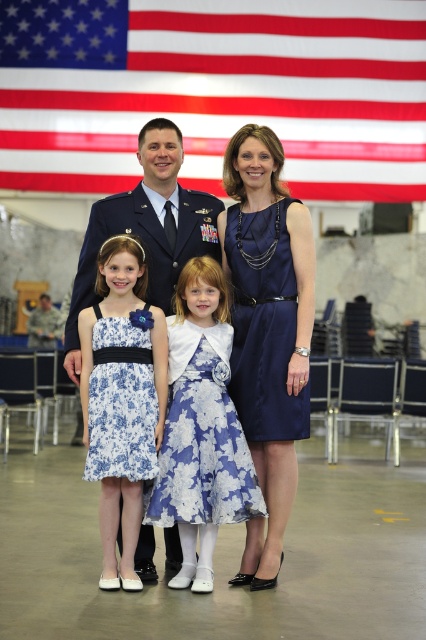
Question: Which is farther from the satin blue dress at center?

Choices:
 (A) red/white striped fabric at upper center
 (B) blue satin uniform at center

Answer: (A)

Question: Which point appears closest to the camera in this image?

Choices:
 (A) (213, 480)
 (B) (141, 227)
 (C) (325, 22)

Answer: (A)

Question: Can you confirm if navy satin dress at center is bigger than blue satin uniform at center?

Choices:
 (A) yes
 (B) no

Answer: (B)

Question: Can you confirm if satin blue dress at center is positioned below floral satin dress at center?

Choices:
 (A) no
 (B) yes

Answer: (A)

Question: Is the position of floral dress at center less distant than that of floral satin dress at center?

Choices:
 (A) no
 (B) yes

Answer: (A)

Question: Considering the real-world distances, which object is farthest from the red/white striped fabric at upper center?

Choices:
 (A) blue floral dress at lower left
 (B) floral satin dress at center
 (C) blue floral dress at center

Answer: (B)